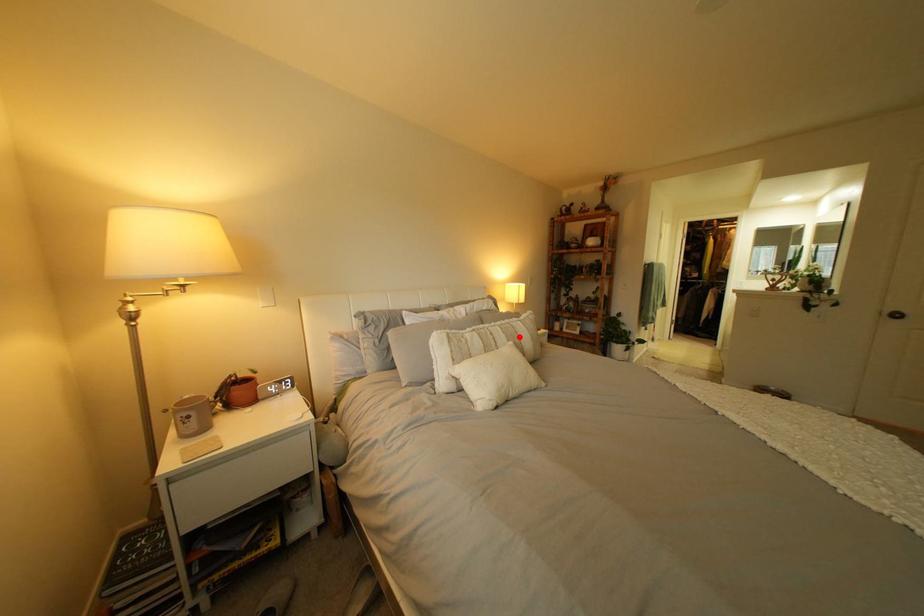
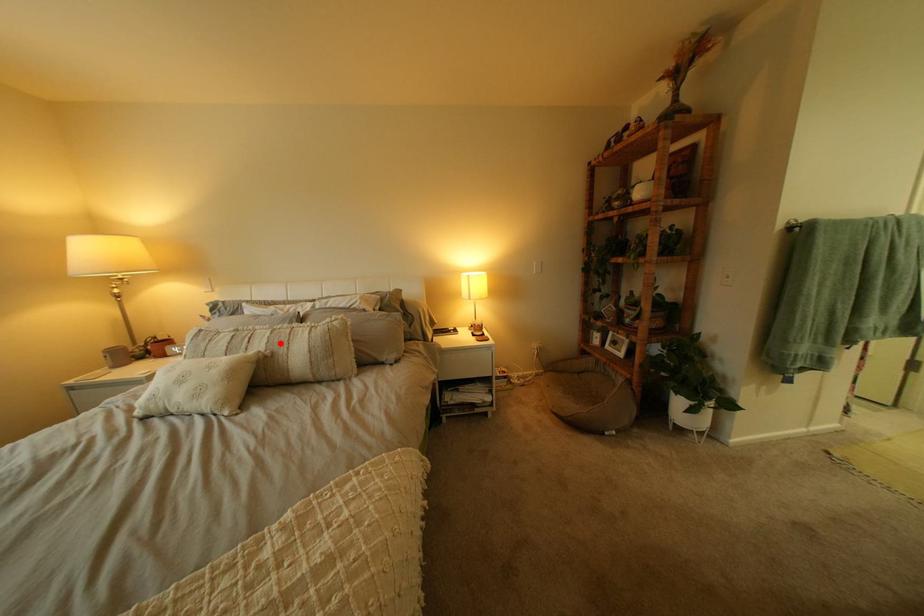
I am providing you with two images of the same scene from different viewpoints. A red point is marked on the first image and another point is marked on the second image. Are the points marked in image1 and image2 representing the same 3D position?

Yes